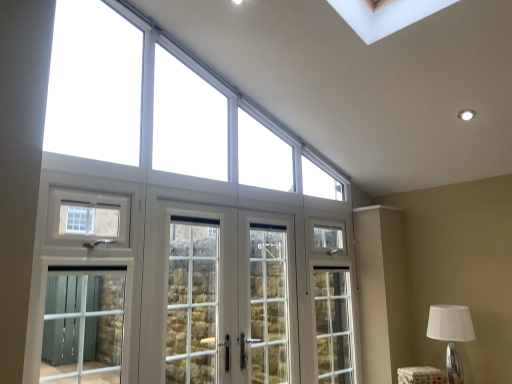
Question: Considering the positions of white glass windows at upper center and white glass doors at center, which is counted as the 2th screen door, starting from the left, in the image, is white glass windows at upper center taller or shorter than white glass doors at center, which is counted as the 2th screen door, starting from the left,?

Choices:
 (A) short
 (B) tall

Answer: (A)

Question: Is white glass windows at upper center inside or outside of white glass doors at center, acting as the second screen door starting from the right?

Choices:
 (A) inside
 (B) outside

Answer: (B)

Question: Considering the real-world distances, which object is closest to the clear glass door at center, which appears as the 3th screen door when viewed from the left?

Choices:
 (A) white fabric lampshade at lower right
 (B) white glass windows at upper center
 (C) white glass door at center, arranged as the first screen door when viewed from the left
 (D) white glass doors at center, acting as the second screen door starting from the right
 (E) white glossy fabric ottoman at lower right

Answer: (D)

Question: Estimate the real-world distances between objects in this image. Which object is closer to the white fabric lampshade at lower right?

Choices:
 (A) white glossy fabric ottoman at lower right
 (B) white glass doors at center, acting as the second screen door starting from the right
 (C) white glass windows at upper center
 (D) clear glass door at center, which appears as the 3th screen door when viewed from the left
 (E) white glass door at center, arranged as the first screen door when viewed from the left

Answer: (A)